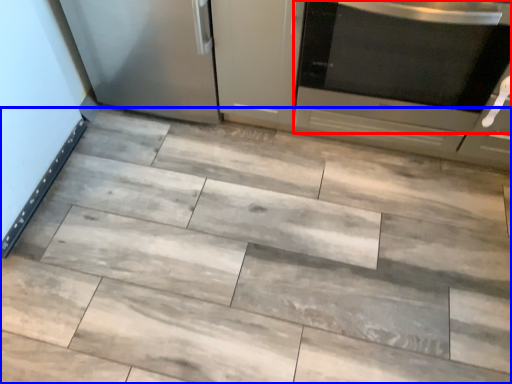
Question: Which of the following is the farthest to the observer, home appliance (highlighted by a red box) or ceramic tile (highlighted by a blue box)?

Choices:
 (A) home appliance
 (B) ceramic tile

Answer: (A)